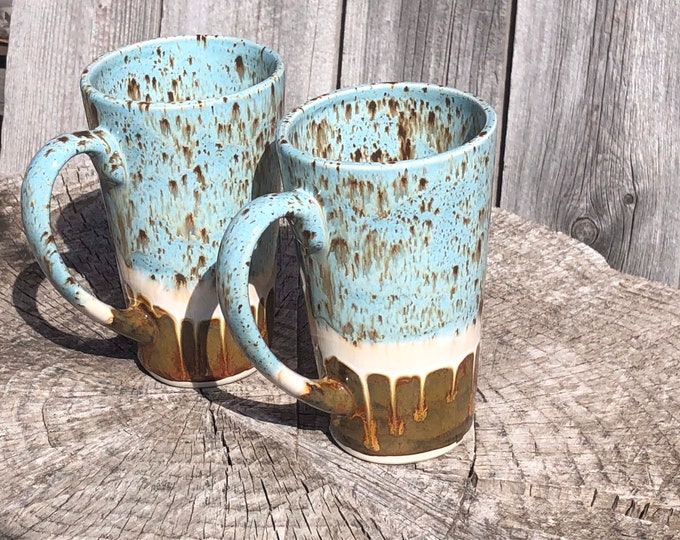
This screenshot has height=540, width=680. I want to click on handle, so click(x=226, y=299).